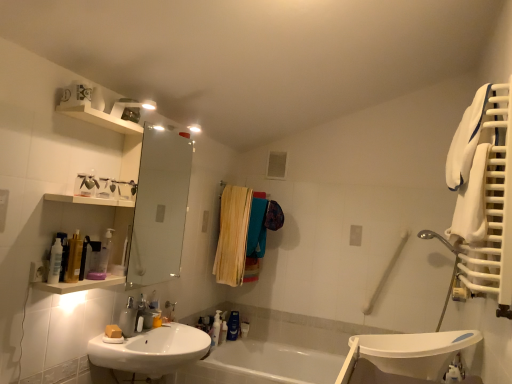
Image resolution: width=512 pixels, height=384 pixels. I want to click on vacant space to the right of matte silver soap dispenser at lower left, so click(158, 336).